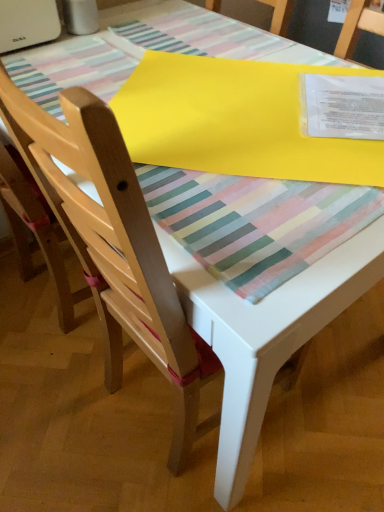
The width and height of the screenshot is (384, 512). Find the location of `free space above matte wood chair at center, which is the first chair in right-to-left order (from a real-world perspective)`. free space above matte wood chair at center, which is the first chair in right-to-left order (from a real-world perspective) is located at coordinates (201, 82).